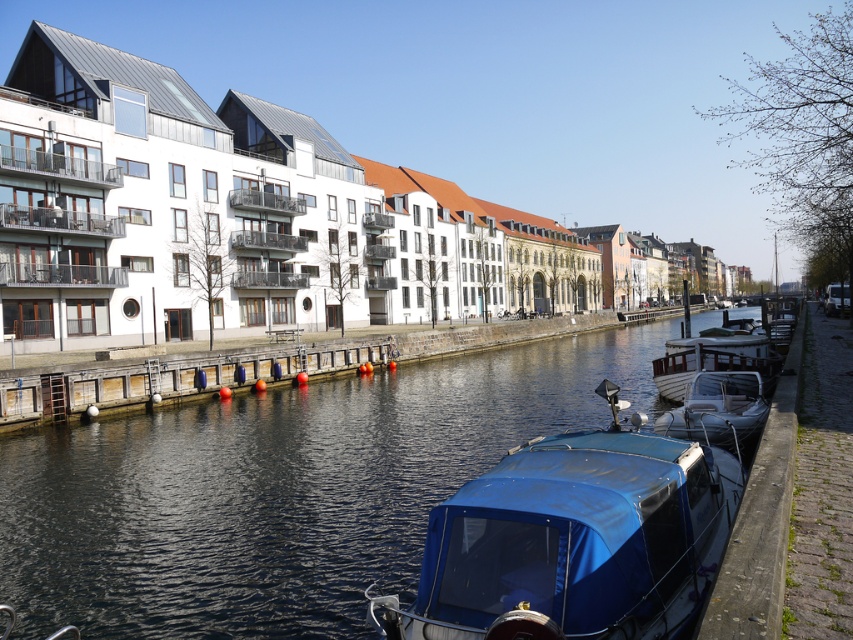
Question: Which point appears closest to the camera in this image?

Choices:
 (A) (67, 412)
 (B) (136, 563)

Answer: (B)

Question: Where is blue tarpaulin boat at center located in relation to white wooden boat at right in the image?

Choices:
 (A) above
 (B) below

Answer: (B)

Question: Estimate the real-world distances between objects in this image. Which object is farther from the smooth wooden dock at center?

Choices:
 (A) white matte boat at right
 (B) dark blue water at center
 (C) white wooden boat at right
 (D) blue tarpaulin boat at center

Answer: (D)

Question: Can you confirm if smooth wooden dock at center is positioned to the left of white wooden boat at right?

Choices:
 (A) yes
 (B) no

Answer: (A)

Question: Among these objects, which one is farthest from the camera?

Choices:
 (A) smooth wooden dock at center
 (B) white wooden boat at right
 (C) blue tarpaulin boat at center
 (D) dark blue water at center

Answer: (A)

Question: From the image, what is the correct spatial relationship of blue tarpaulin boat at center in relation to smooth wooden dock at center?

Choices:
 (A) below
 (B) above

Answer: (A)